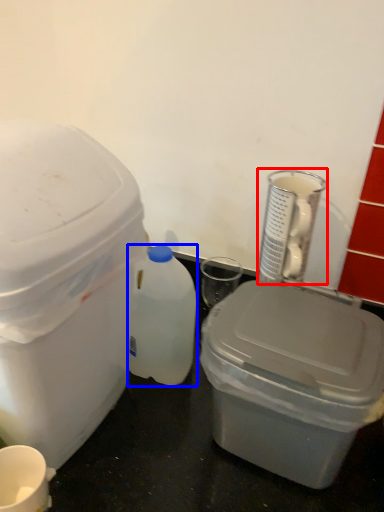
Question: Which point is further to the camera, appliance (highlighted by a red box) or bottle (highlighted by a blue box)?

Choices:
 (A) appliance
 (B) bottle

Answer: (A)